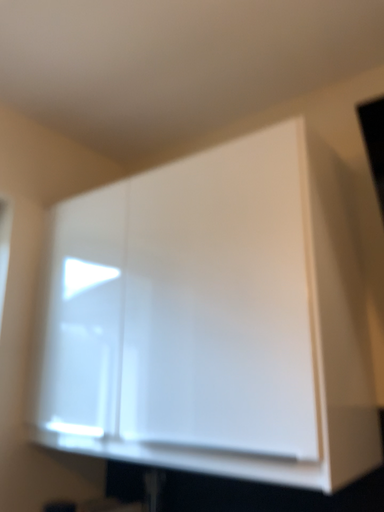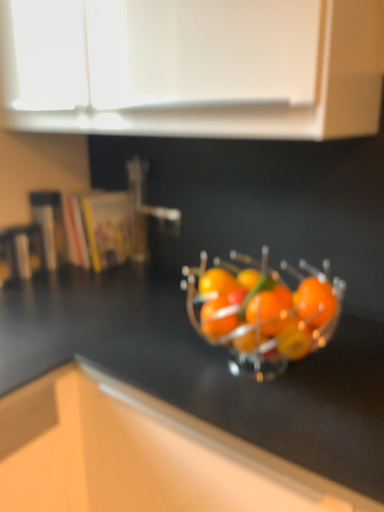
Question: Which way did the camera rotate in the video?

Choices:
 (A) rotated upward
 (B) rotated downward

Answer: (B)